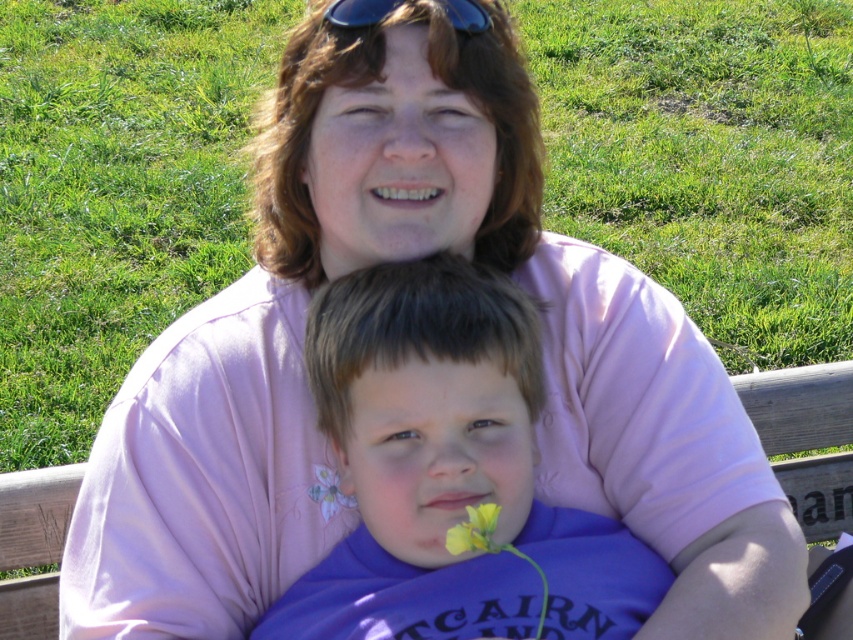
Does point (467, 13) come farther from viewer compared to point (329, 490)?

No.

Is the position of blue plastic sunglasses at upper center less distant than that of pink fabric flower at center?

Yes, it is.

This screenshot has width=853, height=640. What do you see at coordinates (358, 12) in the screenshot?
I see `blue plastic sunglasses at upper center` at bounding box center [358, 12].

In order to click on blue plastic sunglasses at upper center in this screenshot , I will do `click(358, 12)`.

Looking at this image, can you confirm if purple fabric at center is taller than yellow matte flower at lower center?

Yes.

Does point (436, 451) lie behind point (457, 541)?

Yes, it is.

Where is `purple fabric at center`? purple fabric at center is located at coordinates (448, 472).

Which is more to the left, purple fabric at center or blue plastic sunglasses at upper center?

From the viewer's perspective, blue plastic sunglasses at upper center appears more on the left side.

Is purple fabric at center wider than blue plastic sunglasses at upper center?

Correct, the width of purple fabric at center exceeds that of blue plastic sunglasses at upper center.

Who is more distant from viewer, (370, 428) or (444, 8)?

Point (444, 8)

The height and width of the screenshot is (640, 853). What are the coordinates of `purple fabric at center` in the screenshot? It's located at (448, 472).